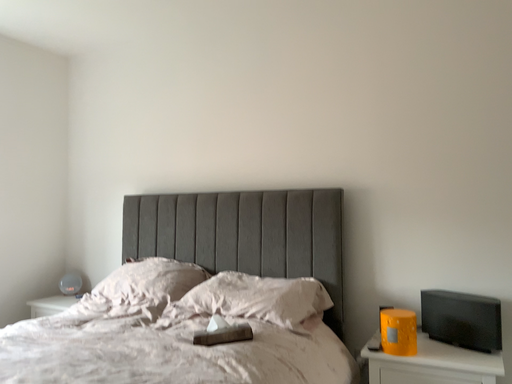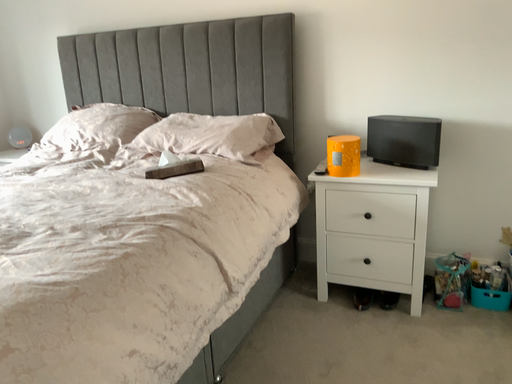
Question: Which way did the camera rotate in the video?

Choices:
 (A) rotated upward
 (B) rotated downward

Answer: (B)